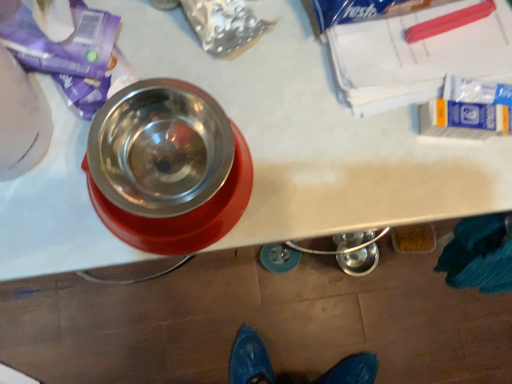
Question: From the image's perspective, is translucent plastic container at lower right beneath metallic stainless steel bowl at upper left?

Choices:
 (A) yes
 (B) no

Answer: (A)

Question: Is translucent plastic container at lower right not within metallic stainless steel bowl at upper left?

Choices:
 (A) no
 (B) yes

Answer: (B)

Question: Considering the relative sizes of translucent plastic container at lower right and metallic stainless steel bowl at upper left in the image provided, is translucent plastic container at lower right shorter than metallic stainless steel bowl at upper left?

Choices:
 (A) yes
 (B) no

Answer: (A)

Question: Is translucent plastic container at lower right facing towards metallic stainless steel bowl at upper left?

Choices:
 (A) yes
 (B) no

Answer: (B)

Question: Considering the relative positions of translucent plastic container at lower right and metallic stainless steel bowl at upper left in the image provided, is translucent plastic container at lower right to the right of metallic stainless steel bowl at upper left from the viewer's perspective?

Choices:
 (A) yes
 (B) no

Answer: (A)

Question: Is translucent plastic container at lower right bigger than metallic stainless steel bowl at upper left?

Choices:
 (A) no
 (B) yes

Answer: (A)

Question: Is metallic stainless steel bowl at upper left shorter than translucent plastic container at lower right?

Choices:
 (A) no
 (B) yes

Answer: (A)

Question: Is metallic stainless steel bowl at upper left oriented towards translucent plastic container at lower right?

Choices:
 (A) no
 (B) yes

Answer: (A)

Question: Is metallic stainless steel bowl at upper left positioned with its back to translucent plastic container at lower right?

Choices:
 (A) no
 (B) yes

Answer: (A)

Question: Is metallic stainless steel bowl at upper left thinner than translucent plastic container at lower right?

Choices:
 (A) yes
 (B) no

Answer: (B)

Question: Is translucent plastic container at lower right located within metallic stainless steel bowl at upper left?

Choices:
 (A) yes
 (B) no

Answer: (B)

Question: Is metallic stainless steel bowl at upper left far away from translucent plastic container at lower right?

Choices:
 (A) yes
 (B) no

Answer: (B)

Question: In terms of width, does translucent plastic container at lower right look wider or thinner when compared to metallic stainless steel bowl at upper left?

Choices:
 (A) wide
 (B) thin

Answer: (B)